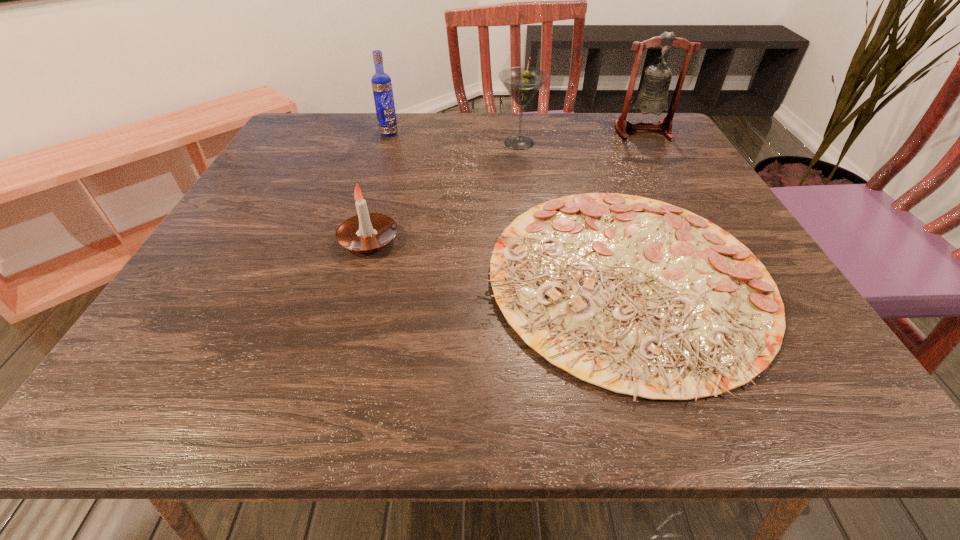
This screenshot has width=960, height=540. In the image, there is a desktop. In order to click on vacant area at the left edge in this screenshot , I will do `click(171, 332)`.

Locate an element on the screen. vacant space at the right edge of the desktop is located at coordinates (x=660, y=164).

Image resolution: width=960 pixels, height=540 pixels. Identify the location of blank space at the far left corner of the desktop. (303, 126).

Image resolution: width=960 pixels, height=540 pixels. Find the location of `vacant space at the near left corner`. vacant space at the near left corner is located at coordinates (171, 377).

The image size is (960, 540). Identify the location of blank space at the far right corner of the desktop. (639, 118).

In order to click on free point between the second shortest object and the martini in this screenshot , I will do `click(444, 191)`.

Find the location of a particular element. The width and height of the screenshot is (960, 540). vacant area that lies between the fourth tallest object and the martini is located at coordinates (444, 191).

Locate an element on the screen. The height and width of the screenshot is (540, 960). vacant area that lies between the tallest object and the fourth tallest object is located at coordinates 506,186.

At what (x,y) coordinates should I click in order to perform the action: click on unoccupied position between the vodka and the second shortest object. Please return your answer as a coordinate pair (x, y). Looking at the image, I should click on tap(379, 186).

Identify the location of unoccupied area between the bell and the martini. (581, 137).